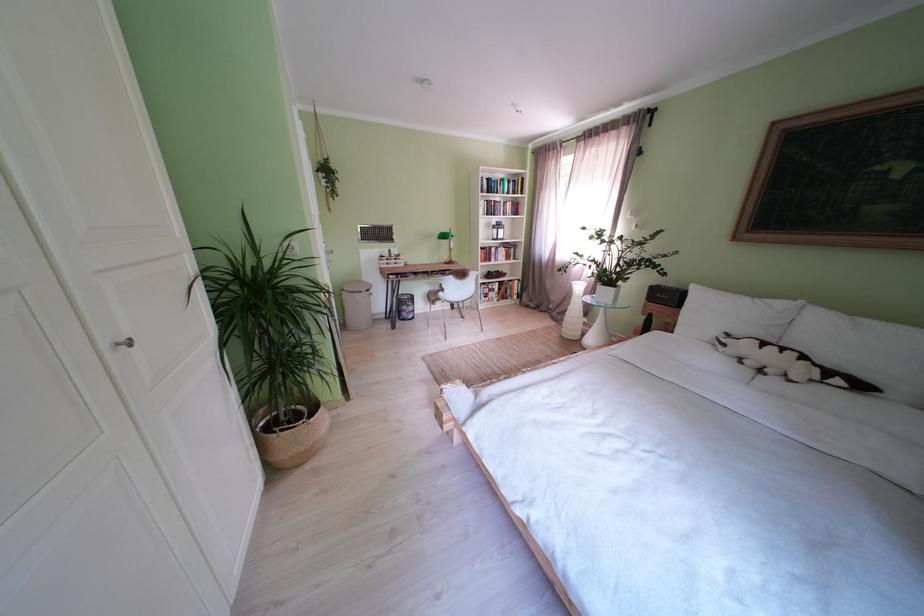
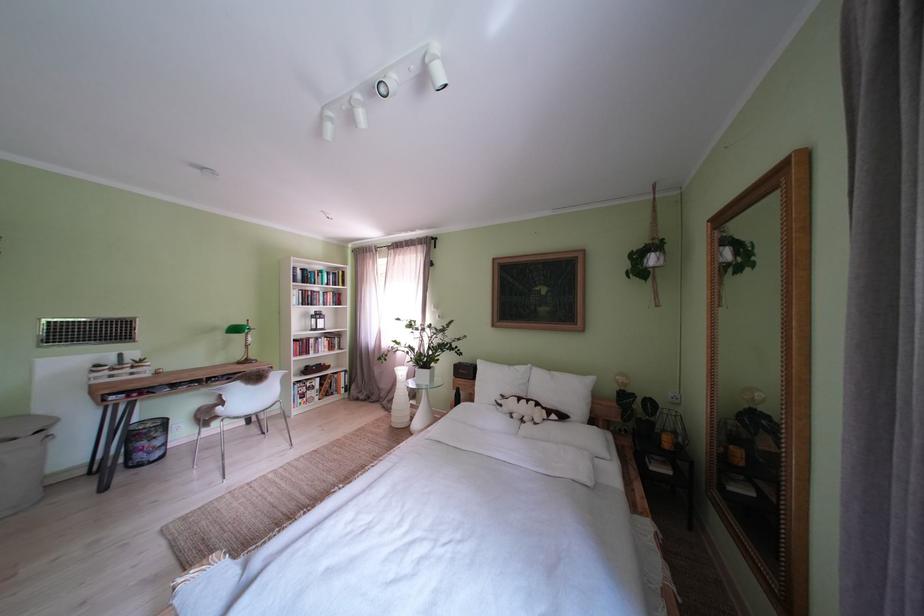
The point at (456, 241) is marked in the first image. Where is the corresponding point in the second image?

(247, 334)